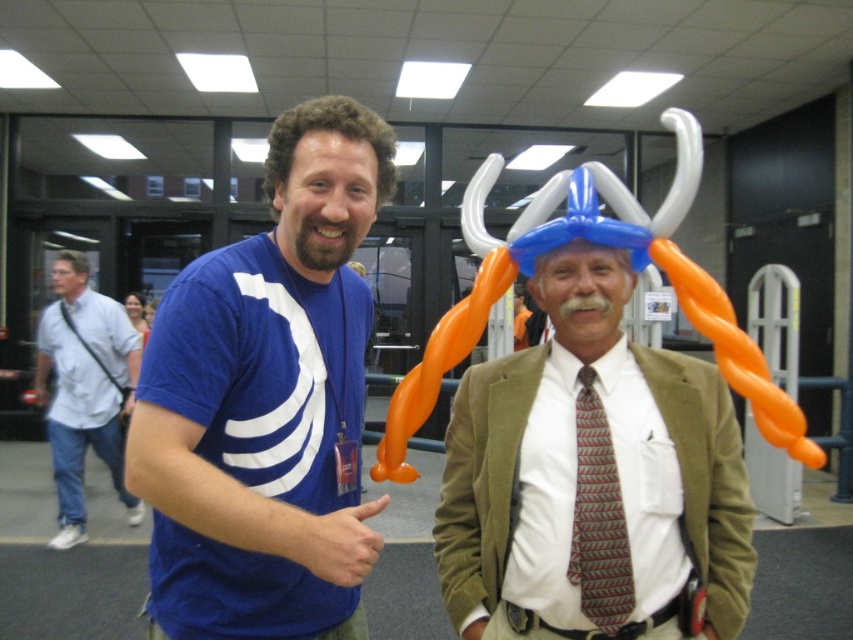
You are standing at the entrance of the convention center and see two points marked in the scene. The first point is at coordinates point [270,394] and the second is at point [627,600]. Which point is closer to you?

Point [270,394] is in front of point [627,600], so it is closer to you.